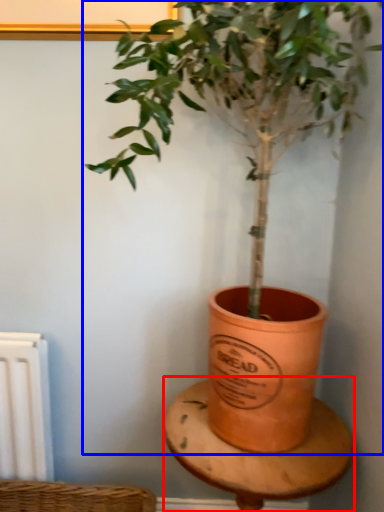
Question: Which object appears farthest to the camera in this image, table (highlighted by a red box) or houseplant (highlighted by a blue box)?

Choices:
 (A) table
 (B) houseplant

Answer: (A)